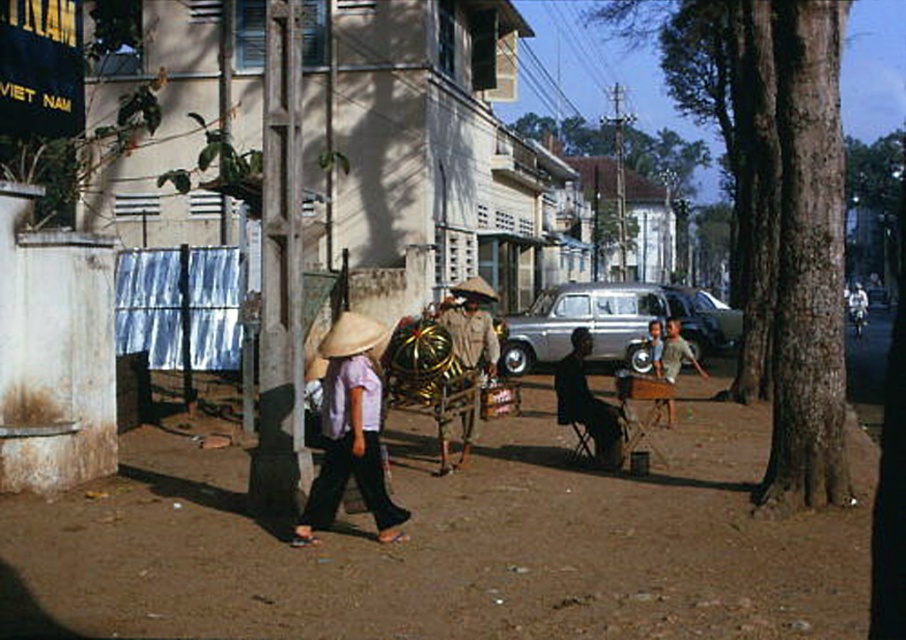
Who is more distant from viewer, (316, 504) or (467, 339)?

Positioned behind is point (467, 339).

The image size is (906, 640). I want to click on light purple cotton shirt at center, so click(350, 433).

Does point (374, 417) lie in front of point (439, 472)?

Yes, point (374, 417) is closer to viewer.

Find the location of a particular element. light purple cotton shirt at center is located at coordinates (350, 433).

Which is in front, point (204, 616) or point (345, 316)?

Point (204, 616) is more forward.

Is brown dirt field at center positioned behind natural straw hat at center?

No, it is not.

Locate an element on the screen. The image size is (906, 640). brown dirt field at center is located at coordinates (447, 547).

Who is taller, silver metallic van at center or brown fabric cart at center?

silver metallic van at center

Is point (620, 310) closer to viewer compared to point (456, 355)?

No, it is not.

At what (x,y) coordinates should I click in order to perform the action: click on silver metallic van at center. Please return your answer as a coordinate pair (x, y). The width and height of the screenshot is (906, 640). Looking at the image, I should click on (611, 323).